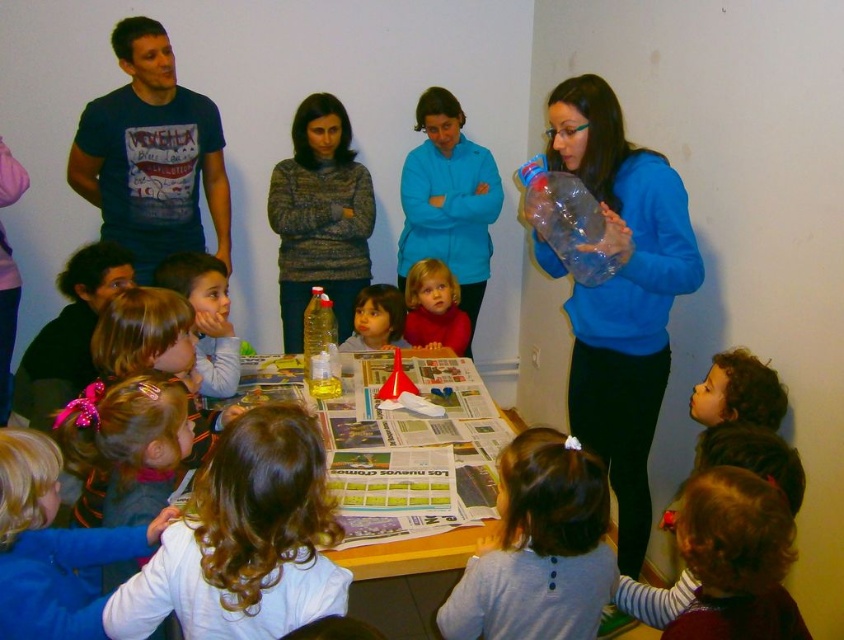
Question: Is white curly hair at center to the left of smooth brown hair at center from the viewer's perspective?

Choices:
 (A) no
 (B) yes

Answer: (B)

Question: Does translucent plastic bottle at upper center appear on the right side of smooth blonde hair at center?

Choices:
 (A) yes
 (B) no

Answer: (A)

Question: Which point is closer to the camera?

Choices:
 (A) translucent plastic bottle at upper center
 (B) smooth blonde hair at center
 (C) blue fleece jacket at upper center

Answer: (A)

Question: Does blue fleece jacket at upper center appear over smooth brown hair at center?

Choices:
 (A) no
 (B) yes

Answer: (B)

Question: Which point is farther to the camera?

Choices:
 (A) (226, 292)
 (B) (406, 289)
 (C) (30, 576)
 (D) (455, 227)

Answer: (D)

Question: Which of these objects is positioned closest to the smooth brown hair at center?

Choices:
 (A) white curly hair at center
 (B) translucent plastic bottle at upper center
 (C) translucent plastic bottle at table center

Answer: (C)